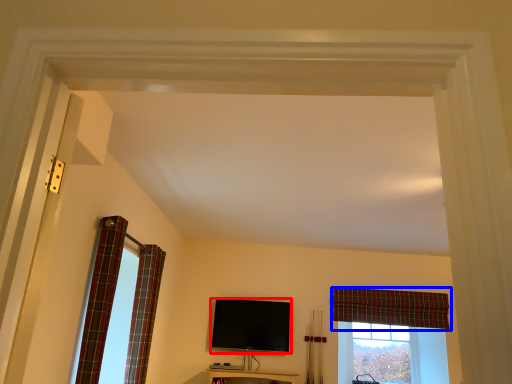
Question: Which of the following is the closest to the observer, television (highlighted by a red box) or curtain (highlighted by a blue box)?

Choices:
 (A) television
 (B) curtain

Answer: (A)